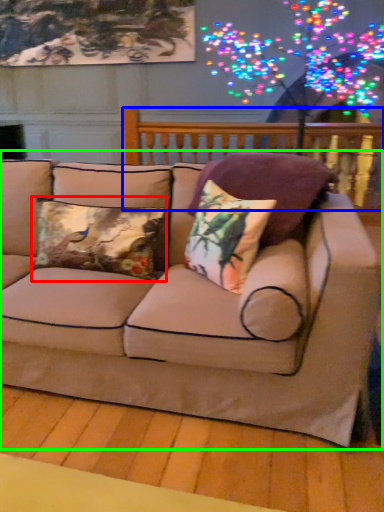
Question: Which is farther away from pillow (highlighted by a red box)? balustrade (highlighted by a blue box) or studio couch (highlighted by a green box)?

Choices:
 (A) balustrade
 (B) studio couch

Answer: (A)